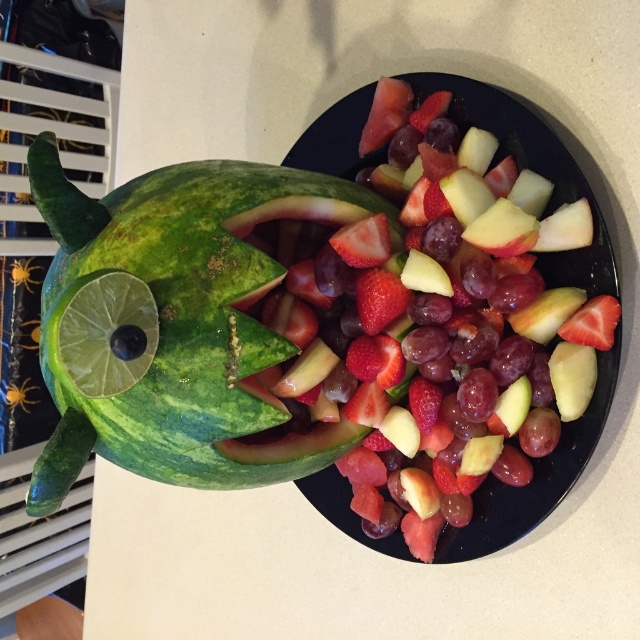
Consider the image. You are standing 40 inches away from the fruit arrangement. Can you reach the point at coordinates point [228,374] without moving closer?

The distance of point [228,374] from camera is 38.56 inches, so yes, you can reach it without moving closer since you are already 40 inches away, which is farther than the point.

You are setting up a fruit display and have both the green striped watermelon at left and the glossy ceramic platter at center. Which object should you place first if you want the larger item to be the focal point?

The glossy ceramic platter at center should be placed first because it is larger than the green striped watermelon at left, making it the focal point.

You are a guest at a fruit arrangement display. You want to pick up the green striped watermelon at left and the glossy ceramic platter at center. Which object should you reach for first if you want to grab the one closer to you?

The green striped watermelon at left is closer to the viewer than the glossy ceramic platter at center, so you should reach for the green striped watermelon at left first.